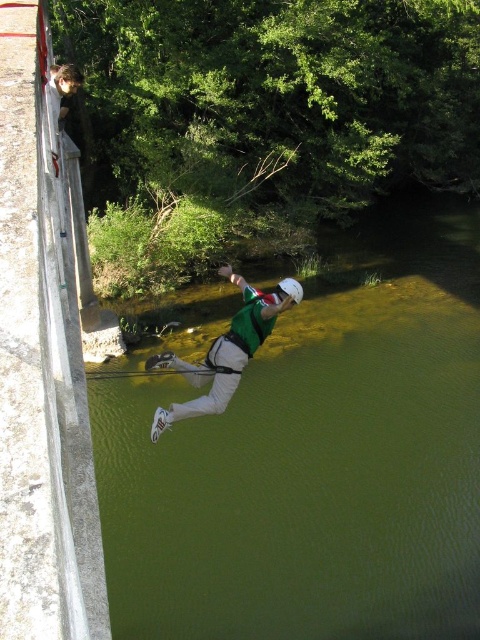
You are a safety officer at the bungee jumping site. You need to ensure the jumper lands safely in the water. Based on the image, is the green smooth water at center positioned to the right or left of the green fabric person at center?

The green smooth water at center is positioned on the right side of green fabric person at center, so the jumper will land in the water to the right of their current position.

Based on the scene description, can you determine if the green smooth water at center is wider than the green fabric person at center?

The green smooth water at center might be wider than green fabric person at center according to the description.